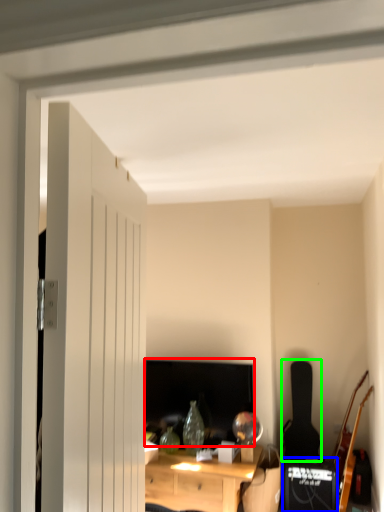
Question: Which is nearer to the computer monitor (highlighted by a red box)? speaker (highlighted by a blue box) or guitar (highlighted by a green box).

Choices:
 (A) speaker
 (B) guitar

Answer: (A)